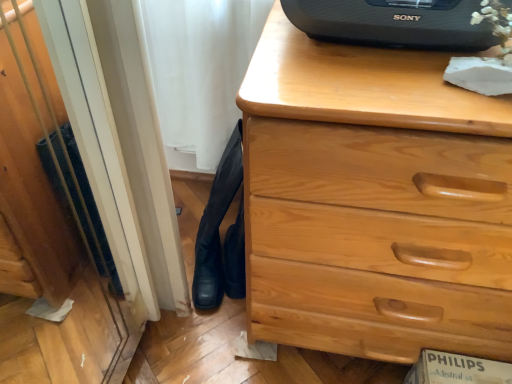
Where is `vacant space in front of black plastic speaker at upper center`? The width and height of the screenshot is (512, 384). vacant space in front of black plastic speaker at upper center is located at coordinates (376, 85).